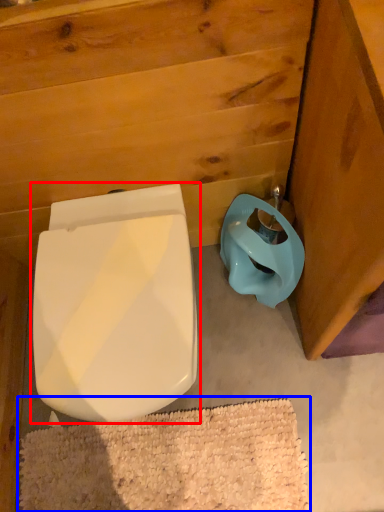
Question: Which of the following is the farthest to the observer, toilet (highlighted by a red box) or bath mat (highlighted by a blue box)?

Choices:
 (A) toilet
 (B) bath mat

Answer: (B)